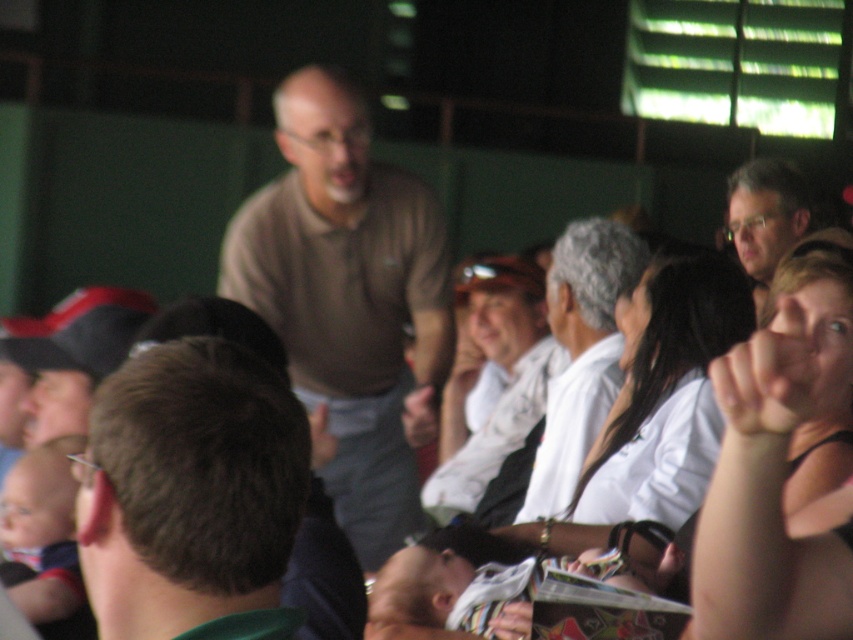
What is the position of the brown matte shirt at center in the image?

The brown matte shirt at center is located at point (x=190, y=492).

You are sitting in the stadium and want to throw a paper airplane to a friend. The paper airplane can only travel in a straight line and has enough energy to reach either point marked as point (251, 536) or point (815, 259). Which point should you aim for to ensure it reaches your friend?

You should aim for point (251, 536) because it is closer to the viewer than point (815, 259), so the paper airplane has a better chance of reaching it.

You are a photographer trying to capture a candid shot of both the brown matte shirt at center and the matte black tank top at upper right. Given their sizes, which one might require you to adjust your camera focus more to ensure clarity?

The brown matte shirt at center has a smaller size compared to matte black tank top at upper right, so you might need to adjust the camera focus more for the brown matte shirt at center to ensure clarity due to its smaller size.